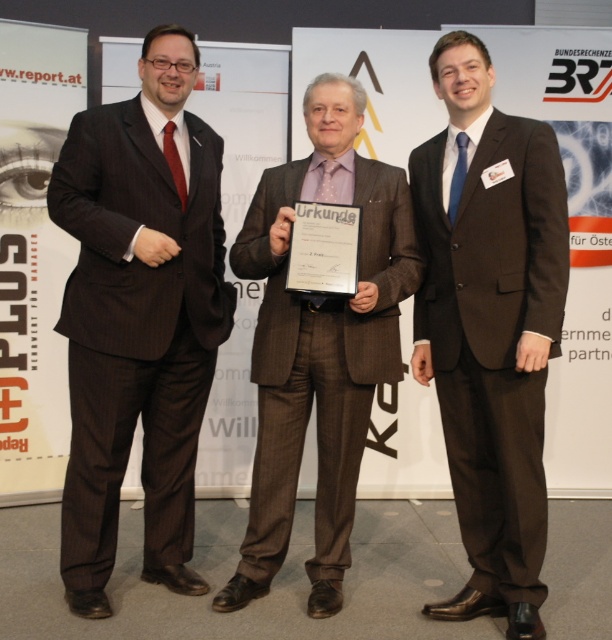
You are an event photographer trying to capture a photo of the two men in the center. The men are wearing the matte brown suit at center and the brown textured suit at center. Which one should you focus on if you want to photograph the taller individual?

The matte brown suit at center is taller than the brown textured suit at center, so you should focus on the matte brown suit at center to photograph the taller individual.